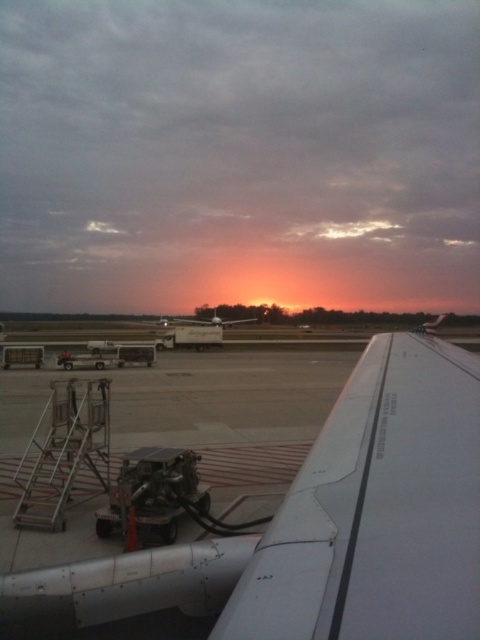
You are a ground crew member who needs to access the white matte wing at upper right and the metallic silver ladder at lower left. Which object is positioned farther to the right side of the image?

The white matte wing at upper right is positioned farther to the right side of the image compared to the metallic silver ladder at lower left.

Looking at this image, you are a maintenance worker needing to access the engine compartment of the white matte airplane at center. You see the metallic silver ladder at lower left. Is the ladder large enough to reach the engine compartment?

The metallic silver ladder at lower left has a smaller size compared to the white matte airplane at center, so it may not be large enough to reach the engine compartment of the white matte airplane at center.

From the picture: You are a ground crew member at the airport. You need to inspect both the white matte wing at upper right and the white matte airplane at center. Which object should you check first if you want to start with the one that is positioned lower in the image?

The white matte wing at upper right is located below the white matte airplane at center, so you should check the white matte wing at upper right first since it is positioned lower.